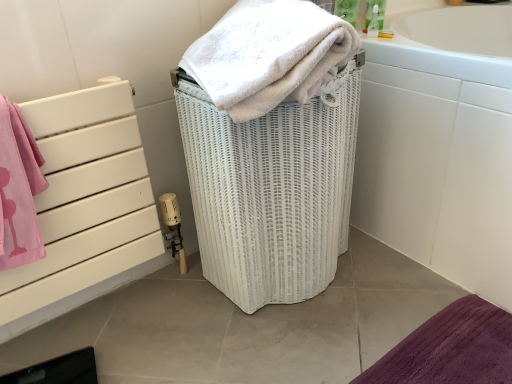
Question: Is white wicker basket at center next to white soft towel at center?

Choices:
 (A) yes
 (B) no

Answer: (B)

Question: Does white wicker basket at center have a greater width compared to white soft towel at center?

Choices:
 (A) no
 (B) yes

Answer: (A)

Question: Is white wicker basket at center positioned with its back to white soft towel at center?

Choices:
 (A) no
 (B) yes

Answer: (A)

Question: Does white wicker basket at center have a larger size compared to white soft towel at center?

Choices:
 (A) yes
 (B) no

Answer: (A)

Question: Is white wicker basket at center aimed at white soft towel at center?

Choices:
 (A) yes
 (B) no

Answer: (B)

Question: Is white wicker basket at center in front of white soft towel at center?

Choices:
 (A) yes
 (B) no

Answer: (B)

Question: Does white wicker basket at center lie in front of white glossy bathtub at right?

Choices:
 (A) no
 (B) yes

Answer: (B)

Question: Is white wicker basket at center further to the viewer compared to white glossy bathtub at right?

Choices:
 (A) no
 (B) yes

Answer: (A)

Question: Is white wicker basket at center wider than white glossy bathtub at right?

Choices:
 (A) yes
 (B) no

Answer: (B)

Question: Is white wicker basket at center turned away from white glossy bathtub at right?

Choices:
 (A) no
 (B) yes

Answer: (A)

Question: Is white wicker basket at center at the right side of white glossy bathtub at right?

Choices:
 (A) no
 (B) yes

Answer: (A)

Question: Does white wicker basket at center have a larger size compared to white glossy bathtub at right?

Choices:
 (A) yes
 (B) no

Answer: (B)

Question: Considering the relative sizes of white glossy bathtub at right and white soft towel at center in the image provided, is white glossy bathtub at right thinner than white soft towel at center?

Choices:
 (A) yes
 (B) no

Answer: (B)